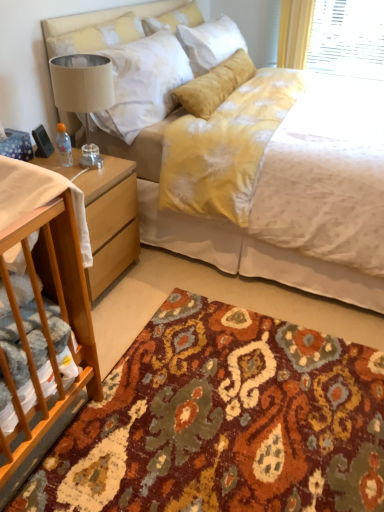
Question: From a real-world perspective, does beige fabric lampshade at left sit lower than white fabric at left?

Choices:
 (A) yes
 (B) no

Answer: (B)

Question: Is white fabric at left at the back of beige fabric lampshade at left?

Choices:
 (A) no
 (B) yes

Answer: (A)

Question: From a real-world perspective, is beige fabric lampshade at left over white fabric at left?

Choices:
 (A) no
 (B) yes

Answer: (B)

Question: Does beige fabric lampshade at left have a larger size compared to white fabric at left?

Choices:
 (A) no
 (B) yes

Answer: (A)

Question: From the image's perspective, does beige fabric lampshade at left appear higher than white fabric at left?

Choices:
 (A) yes
 (B) no

Answer: (A)

Question: Is the position of beige fabric lampshade at left more distant than that of white fabric at left?

Choices:
 (A) yes
 (B) no

Answer: (A)

Question: From the image's perspective, is soft yellow pillow at upper center located above white fabric at left?

Choices:
 (A) no
 (B) yes

Answer: (B)

Question: Does soft yellow pillow at upper center have a smaller size compared to white fabric at left?

Choices:
 (A) yes
 (B) no

Answer: (A)

Question: From a real-world perspective, is soft yellow pillow at upper center under white fabric at left?

Choices:
 (A) no
 (B) yes

Answer: (A)

Question: Is soft yellow pillow at upper center bigger than white fabric at left?

Choices:
 (A) no
 (B) yes

Answer: (A)

Question: Considering the relative sizes of soft yellow pillow at upper center and white fabric at left in the image provided, is soft yellow pillow at upper center taller than white fabric at left?

Choices:
 (A) no
 (B) yes

Answer: (A)

Question: Is soft yellow pillow at upper center facing towards white fabric at left?

Choices:
 (A) no
 (B) yes

Answer: (A)

Question: Considering the relative sizes of soft yellow pillow at upper center and beige fabric lampshade at left in the image provided, is soft yellow pillow at upper center shorter than beige fabric lampshade at left?

Choices:
 (A) no
 (B) yes

Answer: (B)